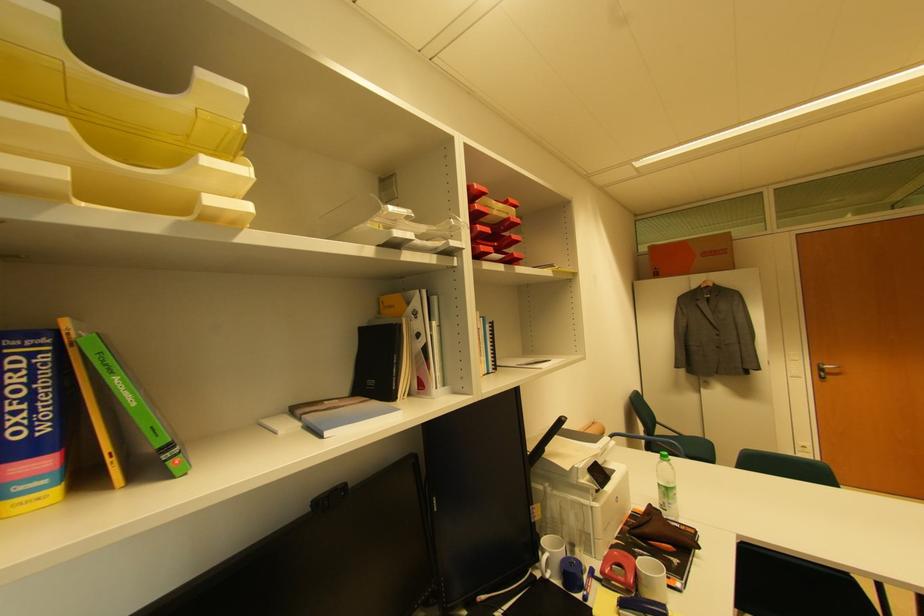
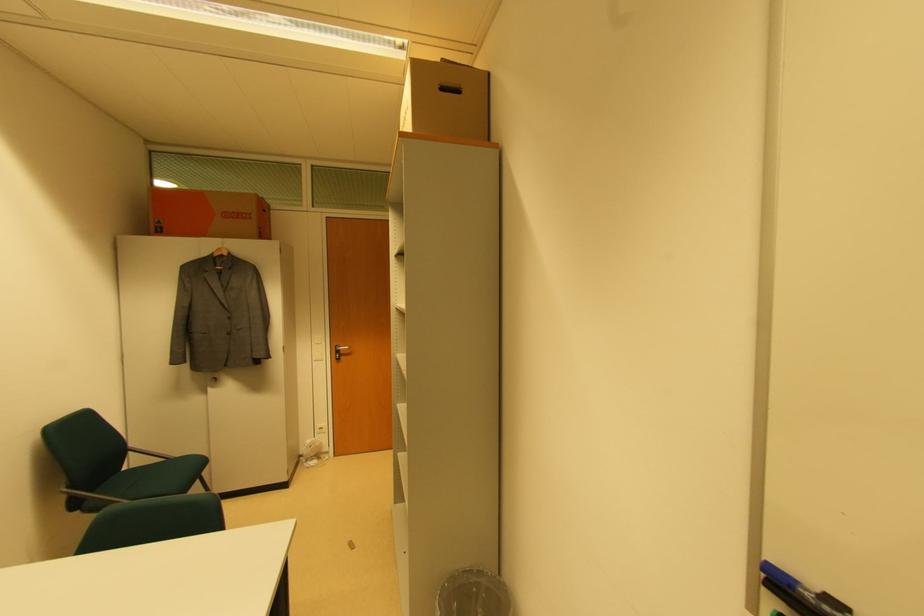
In the second image, find the point that corresponds to pixel 708 386 in the first image.

(216, 382)